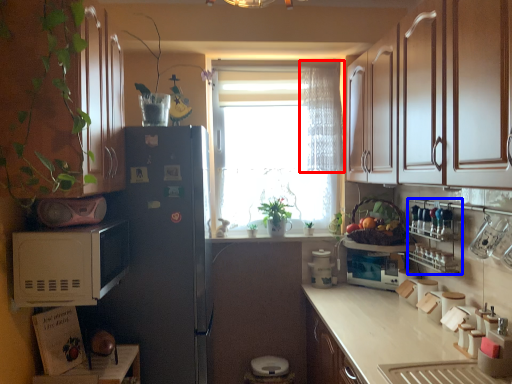
Question: Which point is closer to the camera, curtain (highlighted by a red box) or shelf (highlighted by a blue box)?

Choices:
 (A) curtain
 (B) shelf

Answer: (B)